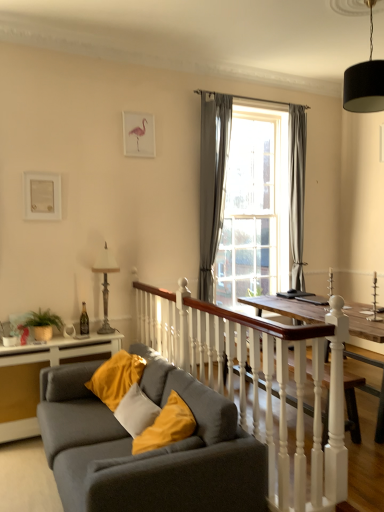
Find the location of a particular element. free space above wooden table at lower left (from a real-world perspective) is located at coordinates (59, 339).